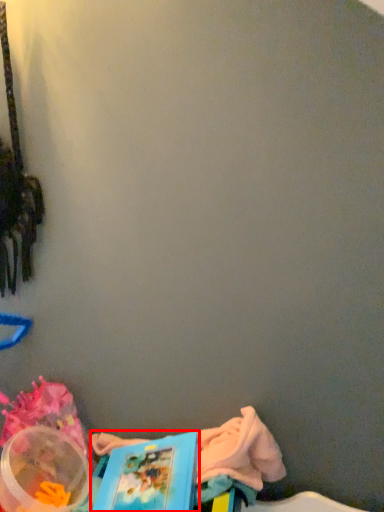
Question: From the image's perspective, where is book (annotated by the red box) located in relation to storage box in the image?

Choices:
 (A) above
 (B) below

Answer: (A)